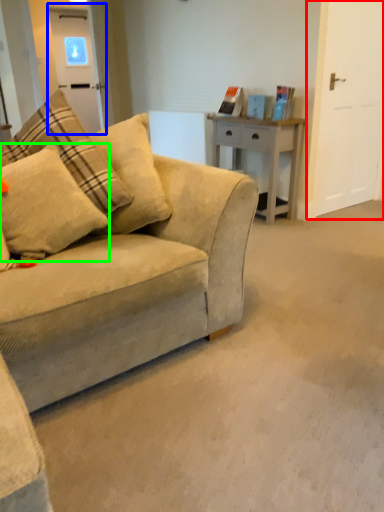
Question: Which object is the farthest from glass door (highlighted by a red box)? Choose among these: glass door (highlighted by a blue box) or pillow (highlighted by a green box).

Choices:
 (A) glass door
 (B) pillow

Answer: (A)